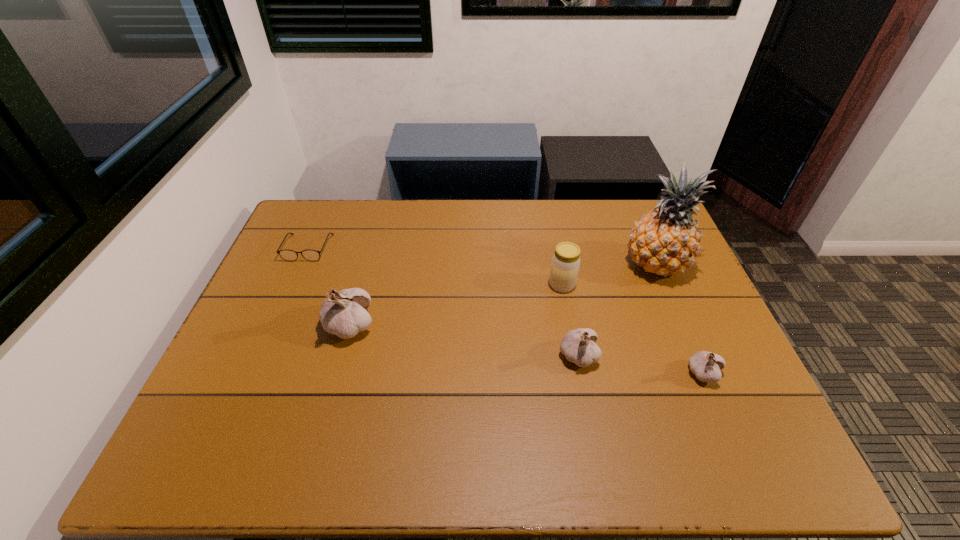
Locate an element on the screen. This screenshot has width=960, height=540. vacant position in the image that satisfies the following two spatial constraints: 1. on the back side of the jar; 2. on the right side of the tallest object is located at coordinates (558, 265).

I want to click on free point that satisfies the following two spatial constraints: 1. on the front-facing side of the spectacles; 2. on the left side of the leftmost garlic, so click(275, 325).